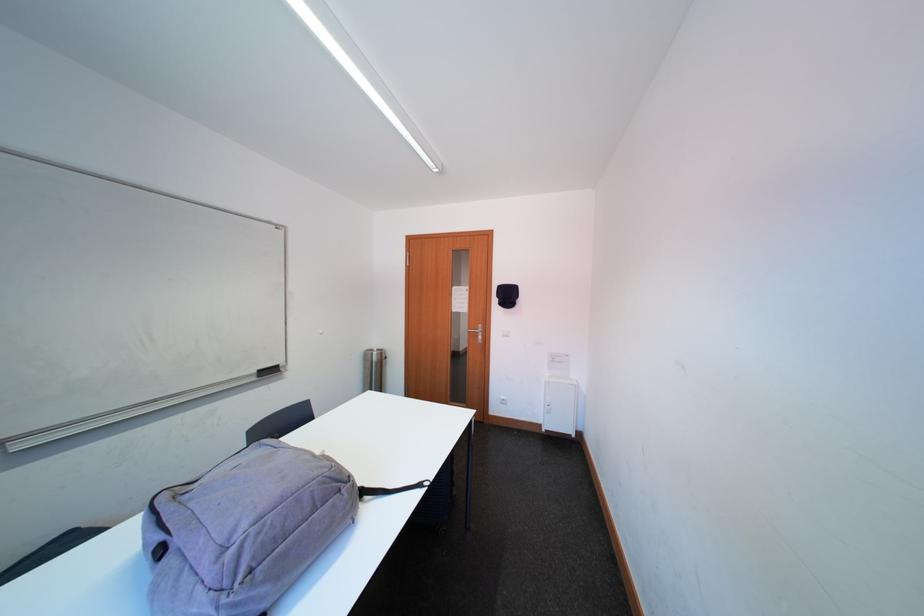
Locate an element on the screen. Image resolution: width=924 pixels, height=616 pixels. silver door handle is located at coordinates (473, 331).